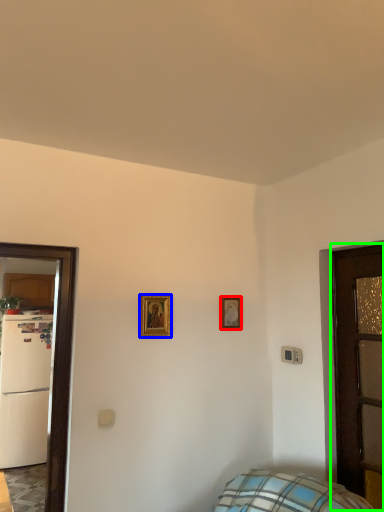
Question: Estimate the real-world distances between objects in this image. Which object is farther from picture frame (highlighted by a red box), picture frame (highlighted by a blue box) or door (highlighted by a green box)?

Choices:
 (A) picture frame
 (B) door

Answer: (B)